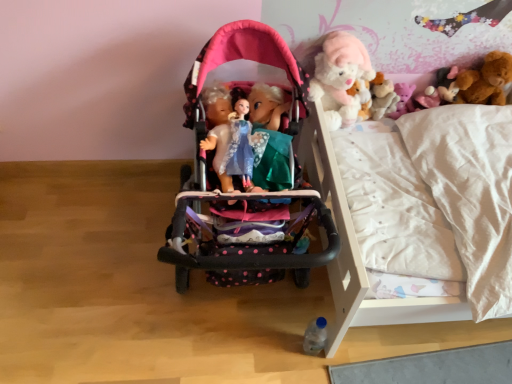
I want to click on white wooden bunk bed at center, so (x=360, y=251).

Locate an element on the screen. The image size is (512, 384). clear plastic bottle at lower center, the first toy positioned from the left is located at coordinates (315, 336).

Measure the distance between point (385,80) and camera.

Point (385,80) is 4.87 feet away from camera.

What do you see at coordinates (486, 80) in the screenshot?
I see `brown plush bear at upper right, arranged as the fourth toy when ordered from the bottom` at bounding box center [486, 80].

What is the approximate height of brown plush bear at upper right, which is the first toy in right-to-left order?

The height of brown plush bear at upper right, which is the first toy in right-to-left order, is 6.49 inches.

Identify the location of matte pink stroller at center. (254, 144).

Considering the sizes of objects matte pink stroller at center and fluffy white teddy bear at upper right, which is counted as the third toy, starting from the bottom, in the image provided, who is taller, matte pink stroller at center or fluffy white teddy bear at upper right, which is counted as the third toy, starting from the bottom,?

fluffy white teddy bear at upper right, which is counted as the third toy, starting from the bottom.

Looking at this image, which object is closer to the camera, matte pink stroller at center or fluffy white teddy bear at upper right, which is counted as the third toy, starting from the bottom?

Positioned in front is matte pink stroller at center.

Is matte pink stroller at center in contact with fluffy white teddy bear at upper right, which is counted as the third toy, starting from the bottom?

matte pink stroller at center is not next to fluffy white teddy bear at upper right, which is counted as the third toy, starting from the bottom, and they're not touching.

Is point (262, 128) positioned after point (366, 53)?

No, (262, 128) is in front of (366, 53).

From a real-world perspective, which object stands above the other?

white wooden bunk bed at center is physically above.

Consider the image. Is white wooden bunk bed at center not close to clear plastic bottle at lower center, which appears as the first toy when ordered from the bottom?

They are positioned close to each other.

Considering the relative sizes of white wooden bunk bed at center and clear plastic bottle at lower center, which appears as the first toy when ordered from the bottom, in the image provided, is white wooden bunk bed at center bigger than clear plastic bottle at lower center, which appears as the first toy when ordered from the bottom,?

Yes, white wooden bunk bed at center is bigger than clear plastic bottle at lower center, which appears as the first toy when ordered from the bottom.

From a real-world perspective, is brown plush bear at upper right, the first toy positioned from the top, on clear plastic bottle at lower center, the first toy positioned from the left?

Indeed, from a real-world perspective, brown plush bear at upper right, the first toy positioned from the top, stands above clear plastic bottle at lower center, the first toy positioned from the left.

Is the surface of brown plush bear at upper right, the first toy positioned from the top, in direct contact with clear plastic bottle at lower center, which appears as the first toy when ordered from the bottom?

No, brown plush bear at upper right, the first toy positioned from the top, is not in contact with clear plastic bottle at lower center, which appears as the first toy when ordered from the bottom.

Is the depth of brown plush bear at upper right, the first toy positioned from the top, less than that of clear plastic bottle at lower center, the first toy positioned from the left?

No.

Based on the photo, from a real-world perspective, is brown plush bear at upper right, which is the first toy in right-to-left order, positioned above or below fluffy white teddy bear at upper right, which is the third toy from right to left?

From a real-world perspective, brown plush bear at upper right, which is the first toy in right-to-left order, is physically below fluffy white teddy bear at upper right, which is the third toy from right to left.

Considering the positions of objects brown plush bear at upper right, which ranks as the fourth toy in left-to-right order, and fluffy white teddy bear at upper right, which is counted as the third toy, starting from the bottom, in the image provided, who is behind, brown plush bear at upper right, which ranks as the fourth toy in left-to-right order, or fluffy white teddy bear at upper right, which is counted as the third toy, starting from the bottom,?

brown plush bear at upper right, which ranks as the fourth toy in left-to-right order, is further away from the camera.

Is brown plush bear at upper right, which ranks as the fourth toy in left-to-right order, to the left of fluffy white teddy bear at upper right, the 2th toy from the top, from the viewer's perspective?

No.

Starting from the fluffy white teddy bear at upper right, which is counted as the third toy, starting from the bottom, which toy is the 1st one behind? Please provide its 2D coordinates.

[(486, 80)]

Based on the photo, how different are the orientations of brown plush bear at upper right, which ranks as the fourth toy in left-to-right order, and matte pink stroller at center in degrees?

88 degrees separate the facing orientations of brown plush bear at upper right, which ranks as the fourth toy in left-to-right order, and matte pink stroller at center.

Where is `person on the left of brown plush bear at upper right, arranged as the fourth toy when ordered from the bottom`? The height and width of the screenshot is (384, 512). person on the left of brown plush bear at upper right, arranged as the fourth toy when ordered from the bottom is located at coordinates (254, 144).

Is brown plush bear at upper right, which is the first toy in right-to-left order, spatially inside matte pink stroller at center, or outside of it?

The correct answer is: outside.

In terms of size, does fluffy white teddy bear at upper right appear bigger or smaller than fluffy white teddy bear at upper right, which is counted as the 2th toy, starting from the left?

Considering their sizes, fluffy white teddy bear at upper right takes up less space than fluffy white teddy bear at upper right, which is counted as the 2th toy, starting from the left.

From a real-world perspective, which is physically above, fluffy white teddy bear at upper right or fluffy white teddy bear at upper right, which is counted as the 2th toy, starting from the left?

fluffy white teddy bear at upper right, which is counted as the 2th toy, starting from the left, from a real-world perspective.

Which is more to the right, fluffy white teddy bear at upper right or fluffy white teddy bear at upper right, which is counted as the 2th toy, starting from the left?

From the viewer's perspective, fluffy white teddy bear at upper right appears more on the right side.

Is fluffy white teddy bear at upper right further to camera compared to fluffy white teddy bear at upper right, which is the third toy from right to left?

That is True.

Which of these two, matte pink stroller at center or fluffy white teddy bear at upper right, is thinner?

Thinner between the two is fluffy white teddy bear at upper right.

How distant is matte pink stroller at center from fluffy white teddy bear at upper right?

matte pink stroller at center and fluffy white teddy bear at upper right are 19.98 inches apart.

Does matte pink stroller at center appear on the left side of fluffy white teddy bear at upper right?

Indeed, matte pink stroller at center is positioned on the left side of fluffy white teddy bear at upper right.

Which is nearer, [286,175] or [389,85]?

The point [286,175] is closer.

Locate an element on the screen. the 2nd toy to the right of the matte pink stroller at center, counting from the anchor's position is located at coordinates (339, 77).

Find the location of `bunk bed that is above the clear plastic bottle at lower center, the fourth toy when ordered from top to bottom (from the image's perspective)`. bunk bed that is above the clear plastic bottle at lower center, the fourth toy when ordered from top to bottom (from the image's perspective) is located at coordinates (360, 251).

Estimate the real-world distances between objects in this image. Which object is closer to fluffy white teddy bear at upper right, brown plush bear at upper right, which is the first toy in right-to-left order, or pink plush bear at upper right, the third toy in the left-to-right sequence?

pink plush bear at upper right, the third toy in the left-to-right sequence, is positioned closer to the anchor fluffy white teddy bear at upper right.

Considering their positions, is brown plush bear at upper right, which ranks as the fourth toy in left-to-right order, positioned further to pink plush bear at upper right, arranged as the 2th toy when viewed from the right, than clear plastic bottle at lower center, which appears as the first toy when ordered from the bottom?

clear plastic bottle at lower center, which appears as the first toy when ordered from the bottom, is further to pink plush bear at upper right, arranged as the 2th toy when viewed from the right.

From the image, which object appears to be farther from clear plastic bottle at lower center, the first toy positioned from the left, pink plush bear at upper right, the 2th toy positioned from the bottom, or white wooden bunk bed at center?

Among the two, pink plush bear at upper right, the 2th toy positioned from the bottom, is located further to clear plastic bottle at lower center, the first toy positioned from the left.

Considering their positions, is clear plastic bottle at lower center, which appears as the first toy when ordered from the bottom, positioned further to pink plush bear at upper right, the third toy in the left-to-right sequence, than white wooden bunk bed at center?

clear plastic bottle at lower center, which appears as the first toy when ordered from the bottom, is further to pink plush bear at upper right, the third toy in the left-to-right sequence.

From the image, which object appears to be nearer to clear plastic bottle at lower center, which appears as the first toy when ordered from the bottom, pink plush bear at upper right, arranged as the 2th toy when viewed from the right, or fluffy white teddy bear at upper right, which is counted as the third toy, starting from the bottom?

fluffy white teddy bear at upper right, which is counted as the third toy, starting from the bottom, is positioned closer to the anchor clear plastic bottle at lower center, which appears as the first toy when ordered from the bottom.

Based on their spatial positions, is white wooden bunk bed at center or fluffy white teddy bear at upper right further from brown plush bear at upper right, which ranks as the fourth toy in left-to-right order?

white wooden bunk bed at center is further to brown plush bear at upper right, which ranks as the fourth toy in left-to-right order.

When comparing their distances from pink plush bear at upper right, which is counted as the third toy, starting from the top, does fluffy white teddy bear at upper right, which is counted as the third toy, starting from the bottom, or brown plush bear at upper right, the first toy positioned from the top, seem further?

The object further to pink plush bear at upper right, which is counted as the third toy, starting from the top, is brown plush bear at upper right, the first toy positioned from the top.

When comparing their distances from white wooden bunk bed at center, does pink plush bear at upper right, arranged as the 2th toy when viewed from the right, or brown plush bear at upper right, arranged as the fourth toy when ordered from the bottom, seem closer?

Based on the image, pink plush bear at upper right, arranged as the 2th toy when viewed from the right, appears to be nearer to white wooden bunk bed at center.

Identify the location of doll situated between matte pink stroller at center and brown plush bear at upper right, the first toy positioned from the top, from left to right. (382, 97).

This screenshot has width=512, height=384. I want to click on bunk bed between pink plush bear at upper right, the 2th toy positioned from the bottom, and clear plastic bottle at lower center, which appears as the first toy when ordered from the bottom, in the up-down direction, so click(x=360, y=251).

Image resolution: width=512 pixels, height=384 pixels. Find the location of `person between pink plush bear at upper right, arranged as the 2th toy when viewed from the right, and clear plastic bottle at lower center, which appears as the first toy when ordered from the bottom, in the vertical direction`. person between pink plush bear at upper right, arranged as the 2th toy when viewed from the right, and clear plastic bottle at lower center, which appears as the first toy when ordered from the bottom, in the vertical direction is located at coordinates (254, 144).

This screenshot has height=384, width=512. I want to click on bunk bed between fluffy white teddy bear at upper right and clear plastic bottle at lower center, the first toy positioned from the left, from top to bottom, so click(360, 251).